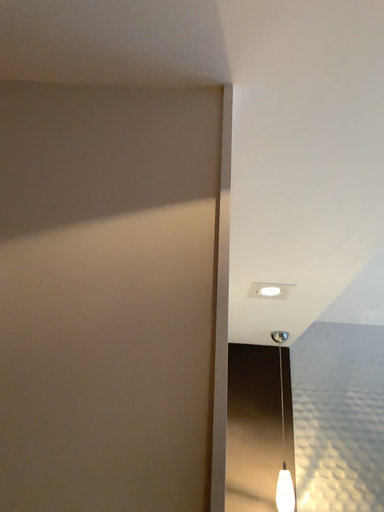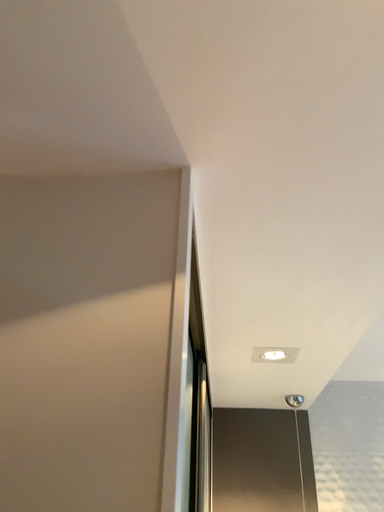
Question: Which way did the camera rotate in the video?

Choices:
 (A) rotated upward
 (B) rotated downward

Answer: (A)